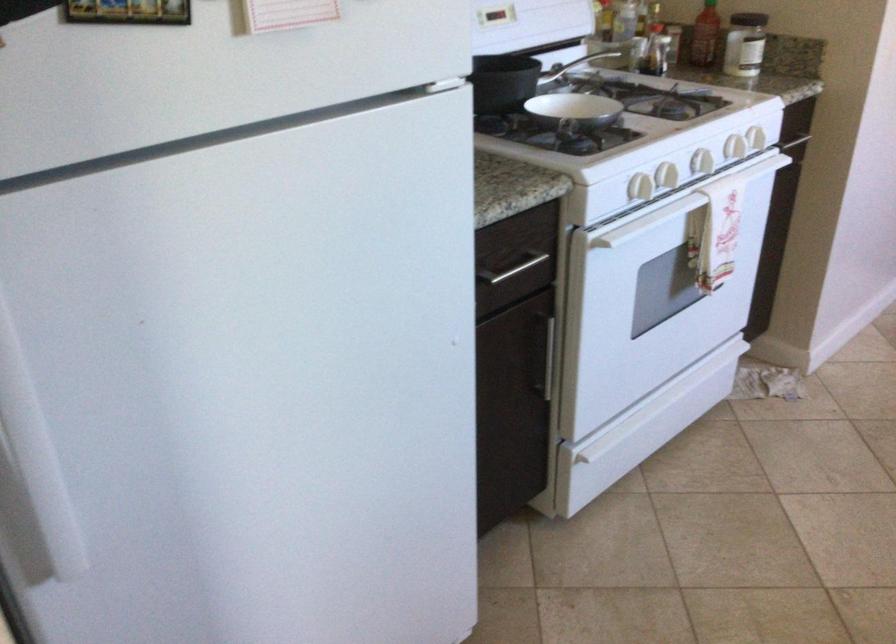
Find where to pull the silver cabinet handle. Please return your answer as a coordinate pair (x, y).

(549, 359)